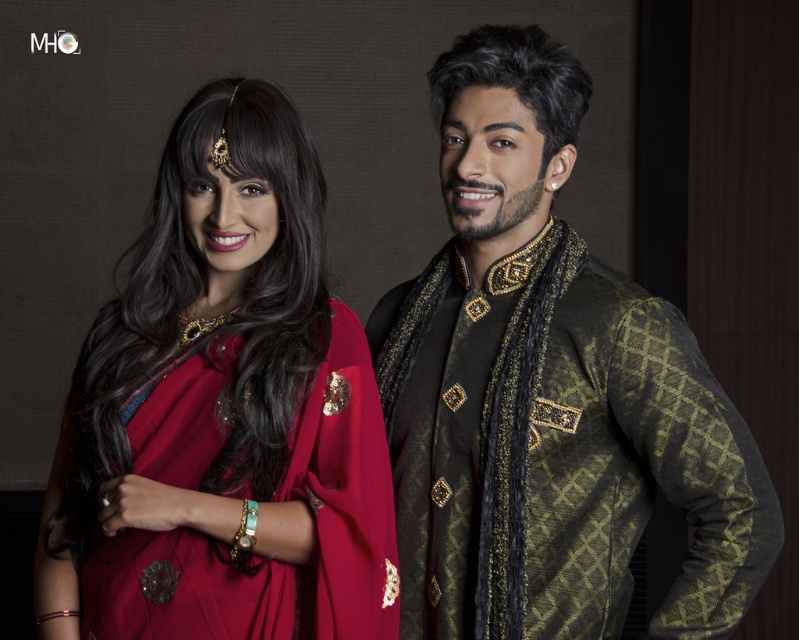
Which of these two, metallic gold and black sherwani at center or matte red sari at left, stands taller?

metallic gold and black sherwani at center

Is metallic gold and black sherwani at center above matte red sari at left?

No.

Does point (533, 186) come farther from viewer compared to point (54, 509)?

Yes, point (533, 186) is farther from viewer.

What are the coordinates of `metallic gold and black sherwani at center` in the screenshot? It's located at (547, 392).